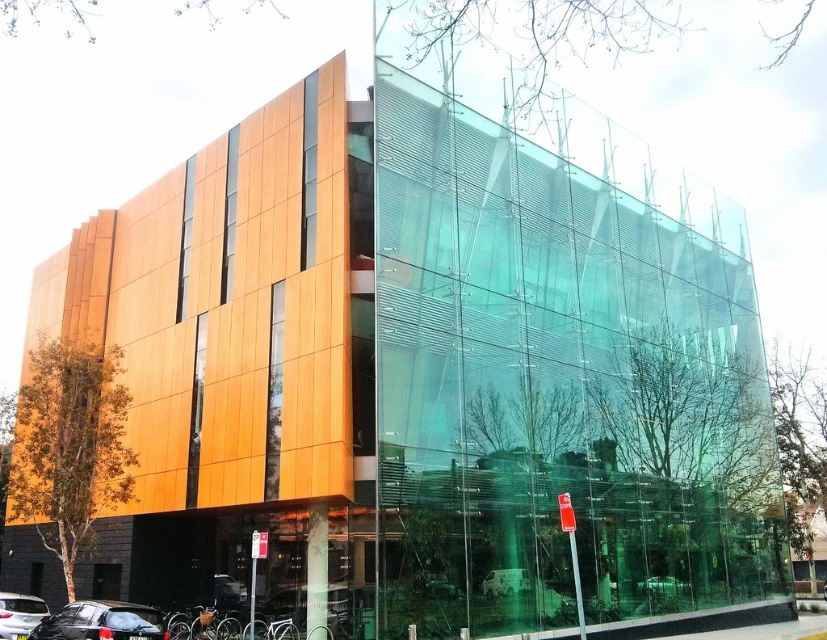
Question: Does black matte car at lower left lie in front of metallic silver car at center?

Choices:
 (A) no
 (B) yes

Answer: (B)

Question: Based on their relative distances, which object is nearer to the metallic silver car at center?

Choices:
 (A) black matte car at lower left
 (B) shiny black car at lower left

Answer: (A)

Question: Where is black matte car at lower left located in relation to metallic silver car at center in the image?

Choices:
 (A) left
 (B) right

Answer: (A)

Question: Which of the following is the closest to the observer?

Choices:
 (A) metallic silver car at center
 (B) black matte car at lower left
 (C) shiny black car at lower left

Answer: (B)

Question: Which object appears farthest from the camera in this image?

Choices:
 (A) black matte car at lower left
 (B) metallic silver car at center
 (C) shiny black car at lower left

Answer: (B)

Question: Does black matte car at lower left appear on the left side of metallic silver car at center?

Choices:
 (A) yes
 (B) no

Answer: (A)